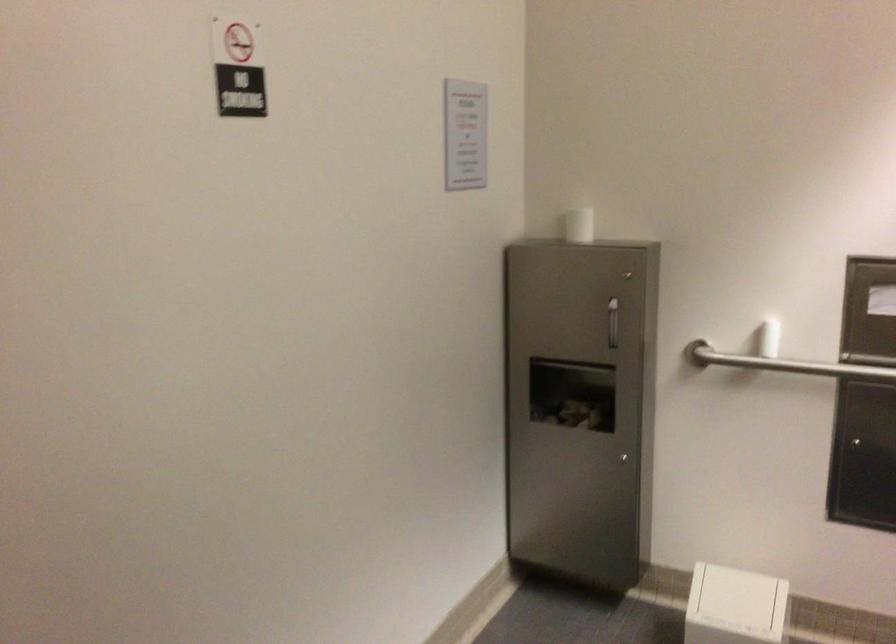
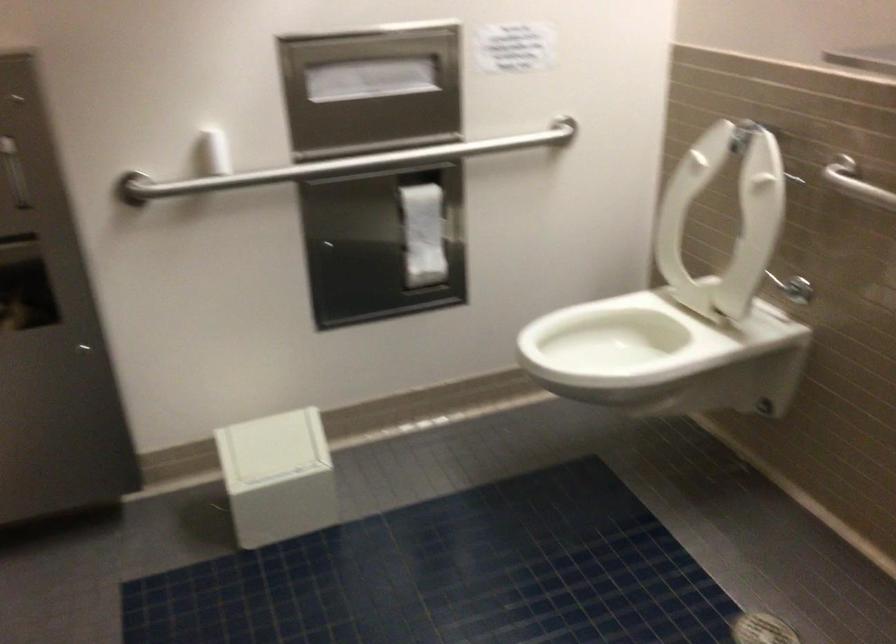
The point at (x=752, y=336) is marked in the first image. Where is the corresponding point in the second image?

(213, 152)